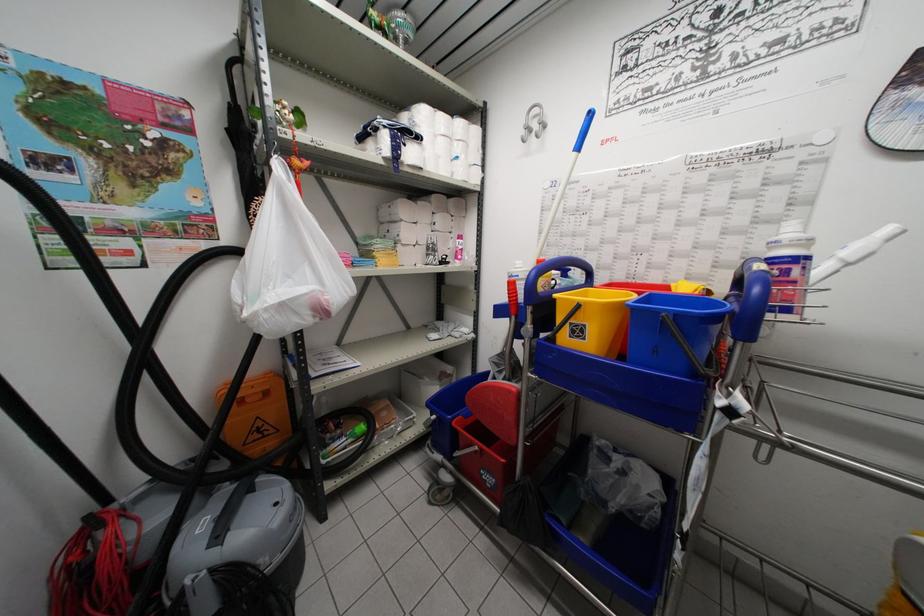
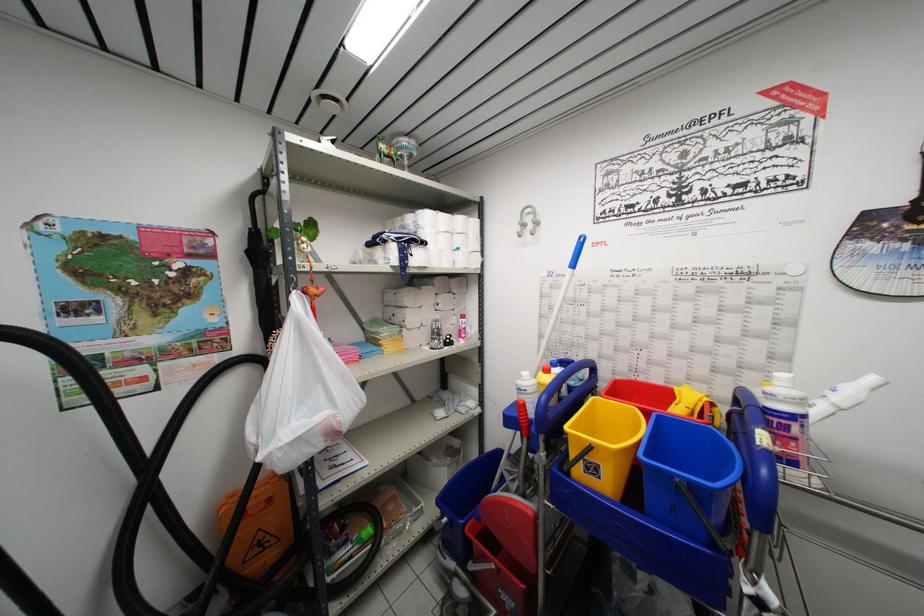
In the second image, find the point that corresponds to pixel 852 269 in the first image.

(845, 415)